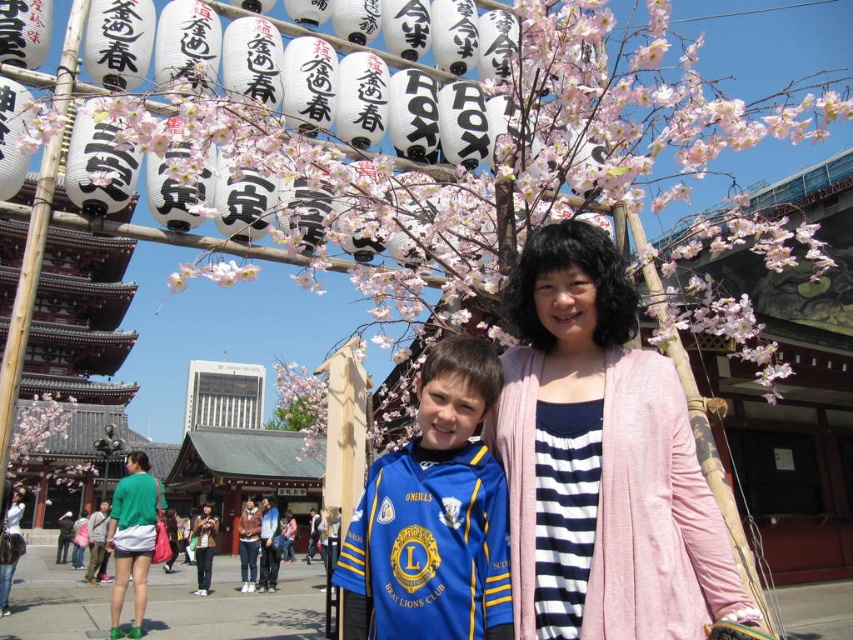
You are standing at the point marked by coordinates point [601,460] in the image. What is the nearest object to you?

The point [601,460] marks pink fabric at center, so the nearest object to you is the pink fabric at center.

You are standing in front of the cherry blossom archway at the Japanese temple. You notice two points marked in the scene. The first point is at coordinates point (338, 573) and the second is at point (125, 531). Which point is closer to you?

Point (338, 573) is closer to the viewer than point (125, 531).